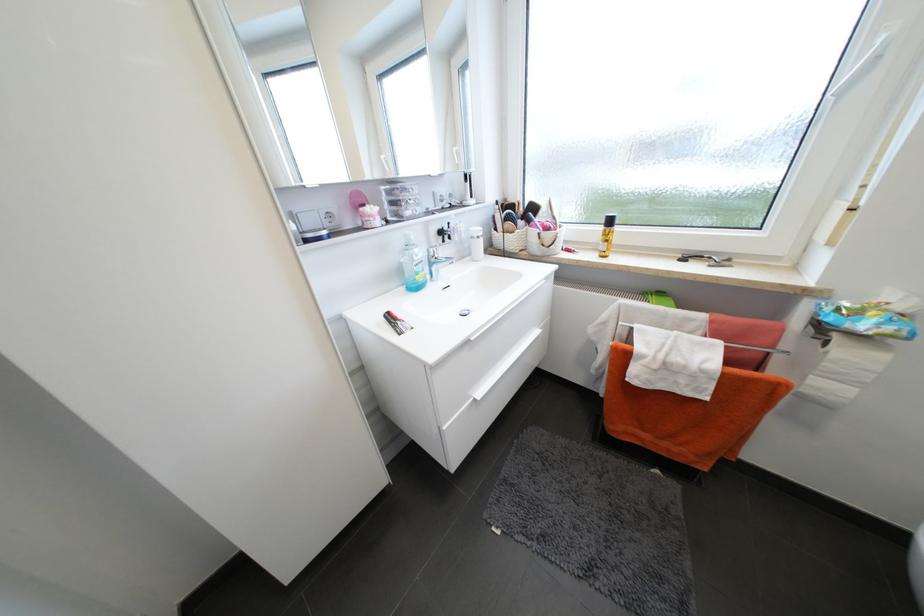
In order to click on faucet handle in this screenshot , I will do `click(439, 257)`.